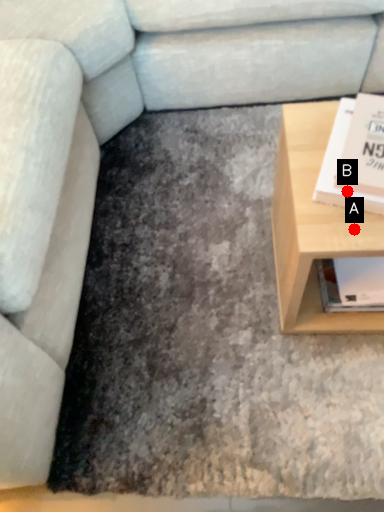
Question: Two points are circled on the image, labeled by A and B beside each circle. Which point is closer to the camera?

Choices:
 (A) A is closer
 (B) B is closer

Answer: (B)